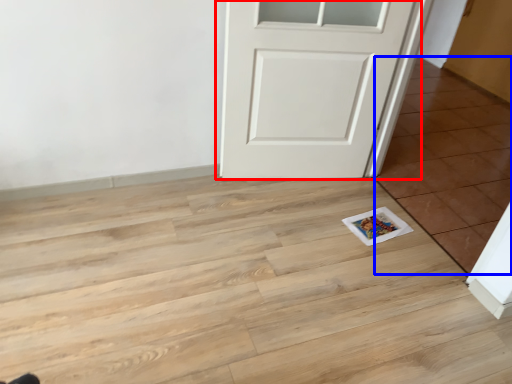
Question: Which point is further to the camera, door (highlighted by a red box) or tile (highlighted by a blue box)?

Choices:
 (A) door
 (B) tile

Answer: (A)